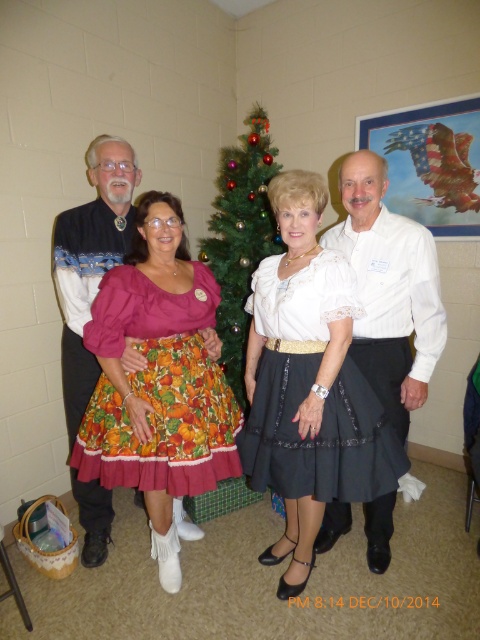
You are a photographer trying to capture a closeup of the green shiny christmas tree at center while ensuring the printed cotton skirt at center remains visible in the frame. Can you focus on the tree while keeping the skirt in the shot?

The printed cotton skirt at center is located below the green shiny christmas tree at center, so yes, you can focus on the tree while keeping the skirt in the shot as it is positioned beneath the tree.

You are a photographer trying to capture a closeup shot of the printed cotton skirt at center and the green shiny christmas tree at center. Which object should you focus on first if you want to ensure both are in focus without adjusting the camera settings?

The printed cotton skirt at center is larger in size than the green shiny christmas tree at center, so you should focus on the larger printed cotton skirt at center first to ensure both are in focus without adjusting the camera settings.

In the scene shown: You are a photographer trying to capture a photo of the black satin dress at center and the white striped shirt at center. Which one will appear taller in the photo?

The black satin dress at center is shorter than the white striped shirt at center, so the white striped shirt at center will appear taller in the photo.